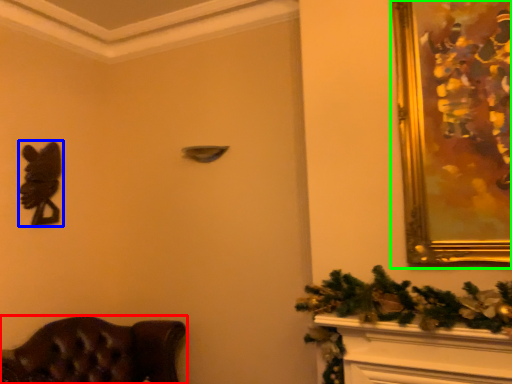
Question: Based on their relative distances, which object is nearer to furniture (highlighted by a red box)? Choose from animal (highlighted by a blue box) and picture frame (highlighted by a green box).

Choices:
 (A) animal
 (B) picture frame

Answer: (A)